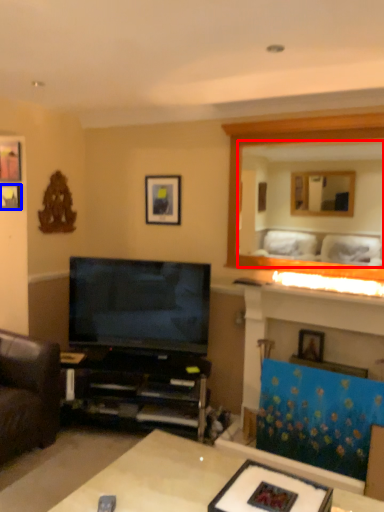
Question: Which of the following is the closest to the observer, mirror (highlighted by a red box) or picture frame (highlighted by a blue box)?

Choices:
 (A) mirror
 (B) picture frame

Answer: (A)